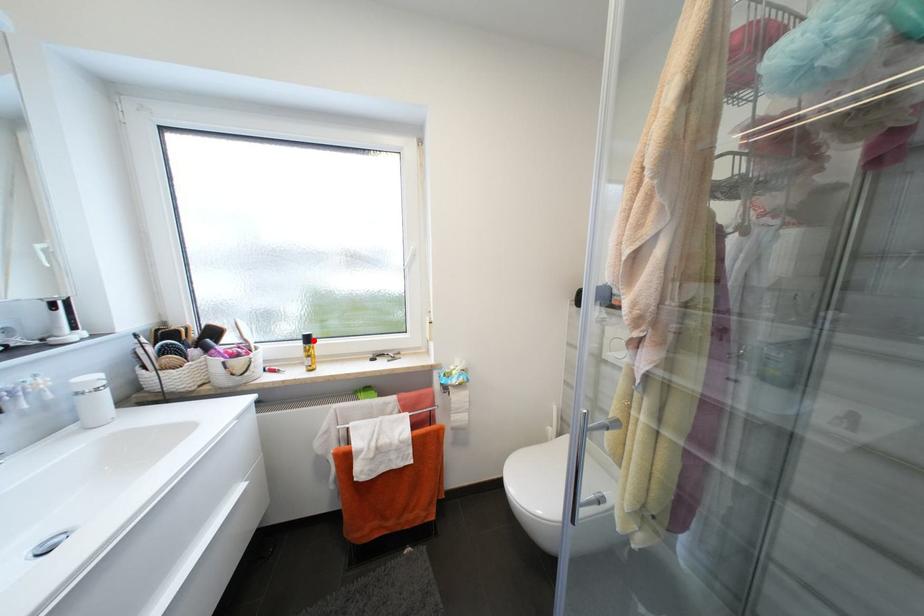
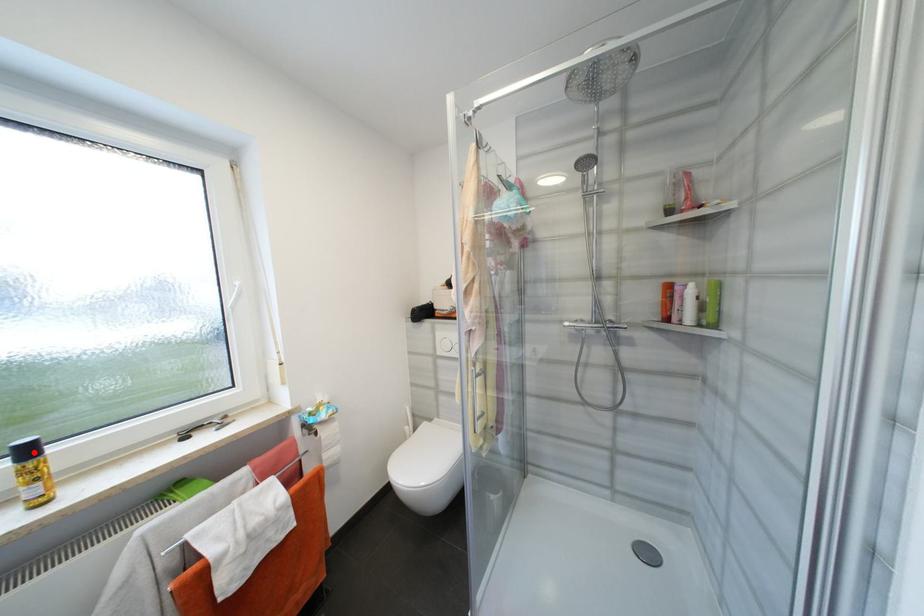
I am providing you with two images of the same scene from different viewpoints. A red point is marked on the first image and another point is marked on the second image. Does the point marked in image1 correspond to the same location as the one in image2?

Yes